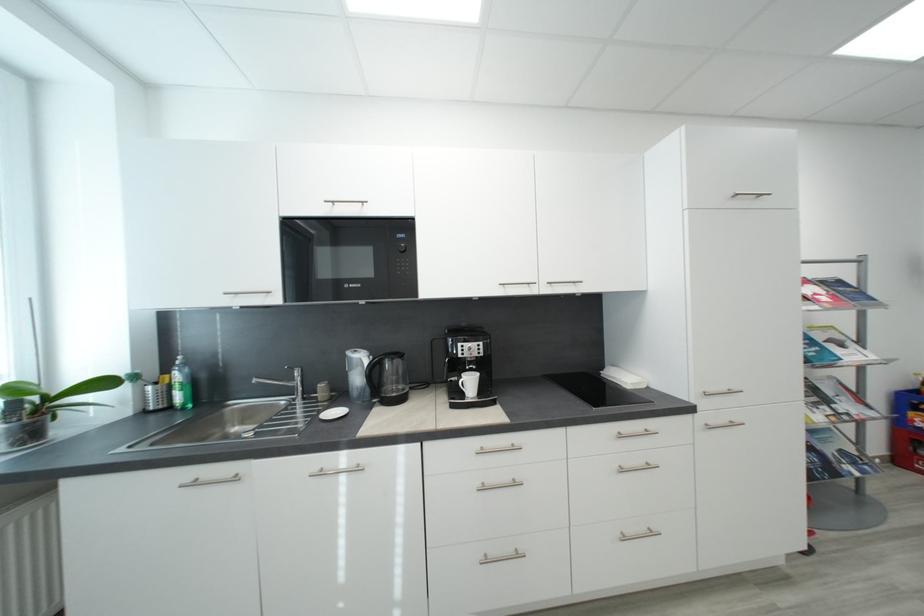
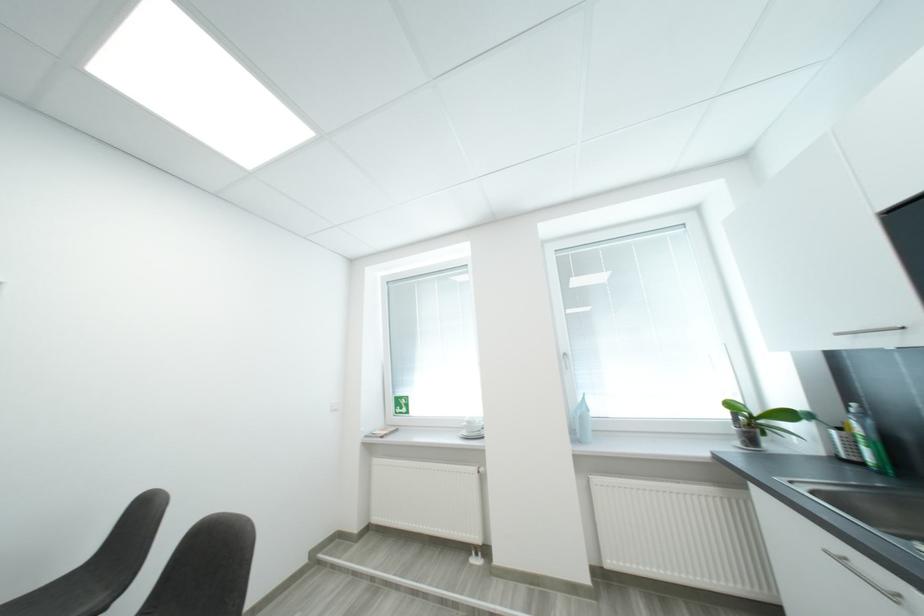
Question: The images are taken continuously from a first-person perspective. In which direction is your viewpoint rotating?

Choices:
 (A) Left
 (B) Right
 (C) Up
 (D) Down

Answer: (A)